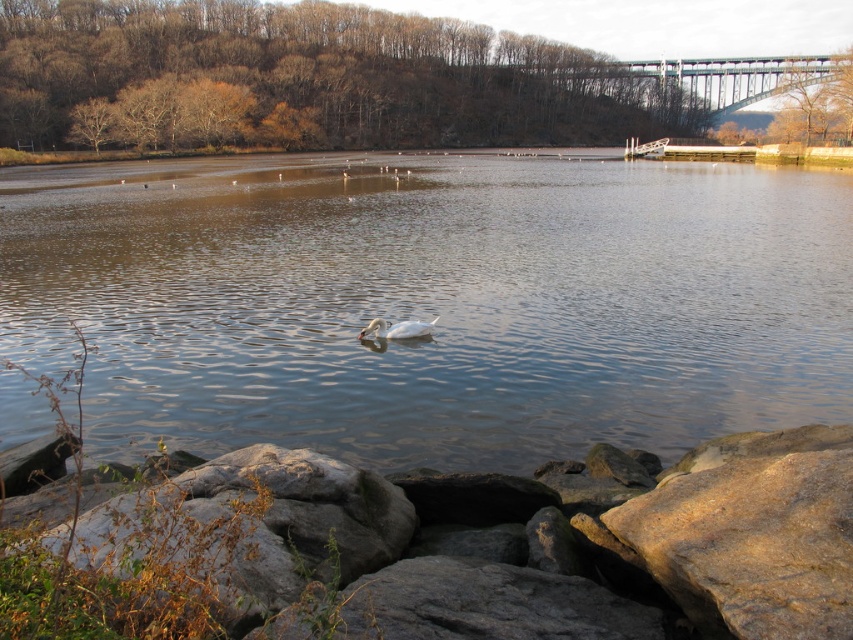
Question: Does brown rough rock at lower center appear on the left side of metallic gray bridge at upper center?

Choices:
 (A) yes
 (B) no

Answer: (A)

Question: From the image, what is the correct spatial relationship of clear water at center in relation to white glossy duck at center?

Choices:
 (A) below
 (B) above

Answer: (B)

Question: Does clear water at center have a larger size compared to brown rough rock at lower center?

Choices:
 (A) yes
 (B) no

Answer: (A)

Question: Which point is farther to the camera?

Choices:
 (A) brown rough rock at lower center
 (B) clear water at center

Answer: (B)

Question: Which point is farther to the camera?

Choices:
 (A) clear water at center
 (B) brown rough rock at lower center
 (C) metallic gray bridge at upper center
 (D) white glossy duck at center

Answer: (C)

Question: Which object is the farthest from the clear water at center?

Choices:
 (A) metallic gray bridge at upper center
 (B) white glossy duck at center
 (C) brown rough rock at lower center

Answer: (A)